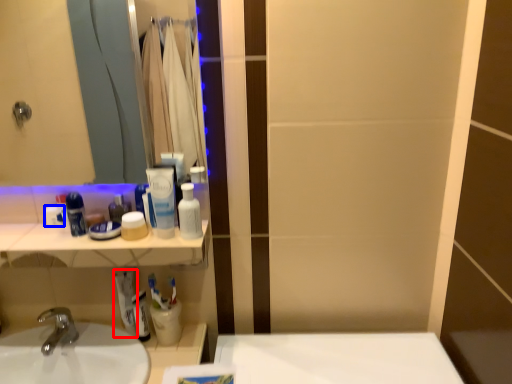
Question: Among these objects, which one is nearest to the camera, toothpaste (highlighted by a red box) or toiletry (highlighted by a blue box)?

Choices:
 (A) toothpaste
 (B) toiletry

Answer: (B)